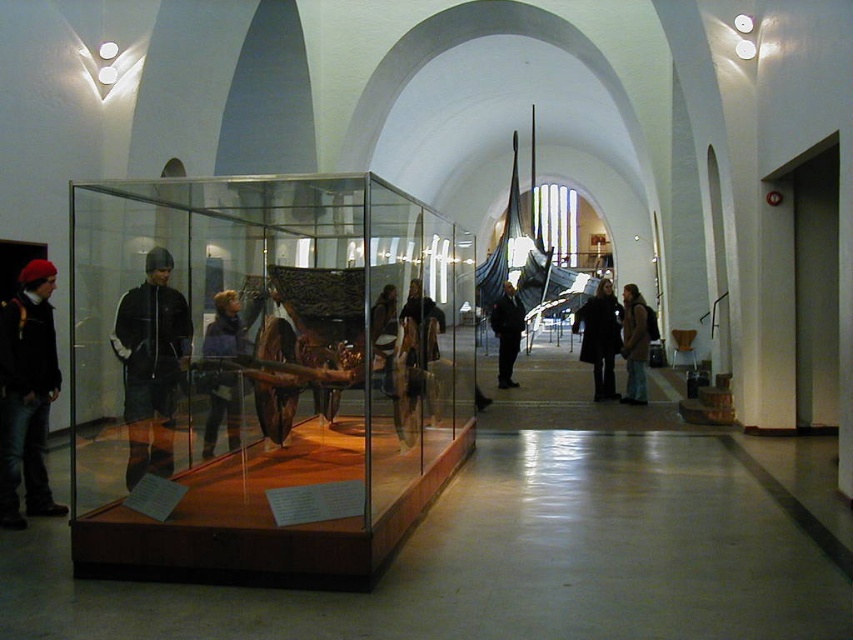
Question: Which point is closer to the camera?

Choices:
 (A) click(13, 524)
 (B) click(126, 300)

Answer: (A)

Question: Which object appears farthest from the camera in this image?

Choices:
 (A) brown leather jacket at center
 (B) black fabric jacket at left

Answer: (A)

Question: Does dark brown leather coat at center appear over black matte jacket at center?

Choices:
 (A) no
 (B) yes

Answer: (A)

Question: In this image, where is matte black jacket at left located relative to black fabric jacket at left?

Choices:
 (A) below
 (B) above

Answer: (A)

Question: Does matte black jacket at left have a smaller size compared to brown leather jacket at center?

Choices:
 (A) yes
 (B) no

Answer: (B)

Question: Which of these objects is positioned farthest from the dark brown leather coat at center?

Choices:
 (A) brown leather jacket at center
 (B) black fabric jacket at left
 (C) matte black jacket at left
 (D) transparent glass boat at center

Answer: (C)